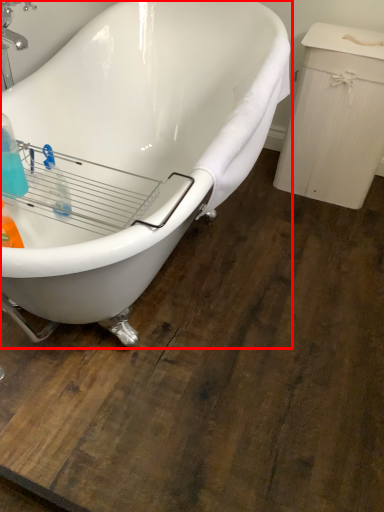
Question: In this image, where is bathtub (annotated by the red box) located relative to cleaning product?

Choices:
 (A) right
 (B) left

Answer: (A)